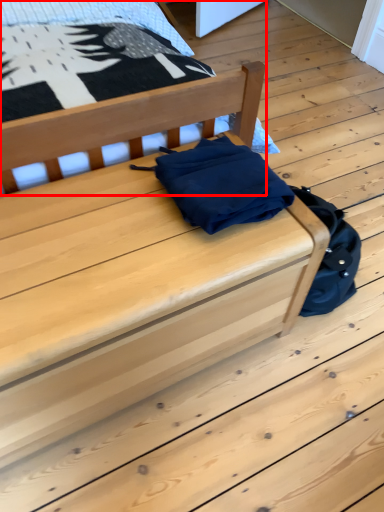
Question: Considering the relative positions of furniture (annotated by the red box) and furniture in the image provided, where is furniture (annotated by the red box) located with respect to the staircase?

Choices:
 (A) right
 (B) left

Answer: (B)